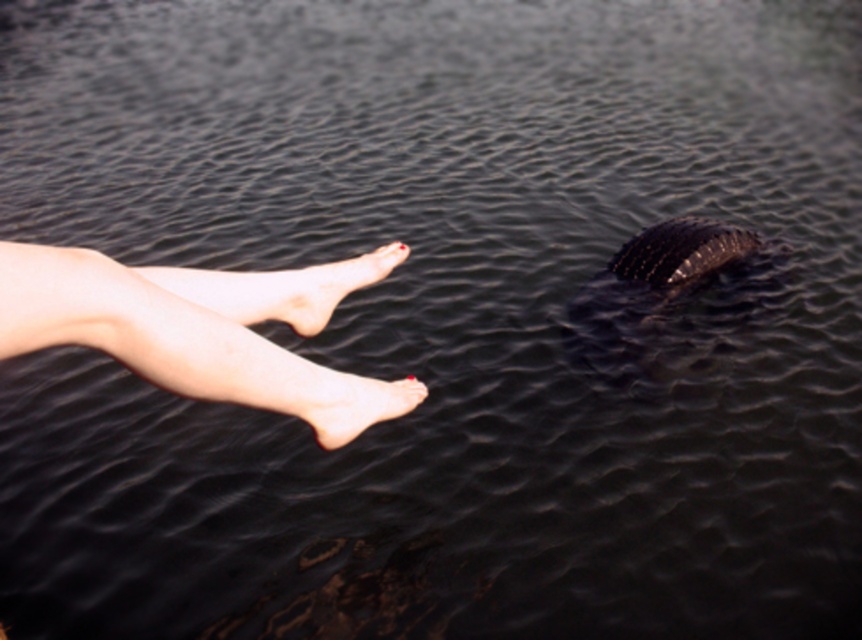
Which is behind, point (119, 362) or point (376, 253)?

The point (376, 253) is behind.

Who is positioned more to the left, smooth skin legs at upper left or pale skin/soft flesh at lower left?

smooth skin legs at upper left is more to the left.

Between point (228, 291) and point (298, 276), which one is positioned in front?

Positioned in front is point (228, 291).

Where is `smooth skin legs at upper left`? The image size is (862, 640). smooth skin legs at upper left is located at coordinates (203, 330).

Is pale skin/soft flesh at lower left shorter than pale skin/soft foot at lower center?

In fact, pale skin/soft flesh at lower left may be taller than pale skin/soft foot at lower center.

Who is taller, pale skin/soft flesh at lower left or pale skin/soft foot at lower center?

pale skin/soft flesh at lower left is taller.

Where is `pale skin/soft flesh at lower left`? The height and width of the screenshot is (640, 862). pale skin/soft flesh at lower left is located at coordinates (322, 288).

The height and width of the screenshot is (640, 862). Identify the location of pale skin/soft flesh at lower left. (322, 288).

Does point (313, 285) come in front of point (347, 420)?

No, (313, 285) is behind (347, 420).

Is smooth skin legs at upper left taller than pale skin/soft foot at lower center?

Yes, smooth skin legs at upper left is taller than pale skin/soft foot at lower center.

Between point (79, 262) and point (330, 397), which one is positioned in front?

Point (79, 262)

The height and width of the screenshot is (640, 862). Identify the location of smooth skin legs at upper left. (203, 330).